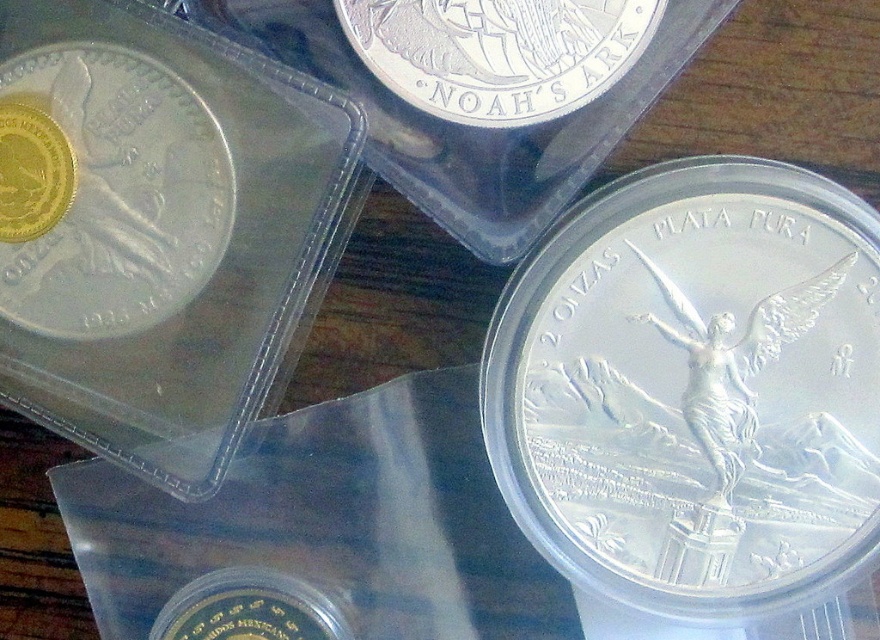
You are an appraiser examining the coins. You need to determine the spatial arrangement between the satin silver coin at center and the gold plated coin at upper left. Which coin is positioned higher on the wooden surface?

The gold plated coin at upper left is positioned higher on the wooden surface since it is located above the satin silver coin at center.

You are a collector standing 1.5 meters away from the satin silver coin at center. Can you reach it without moving your feet?

The satin silver coin at center is 1.04 meters away from the camera, so if you are standing 1.5 meters away from it, you cannot reach it without moving your feet since the distance is greater than the typical arm length.